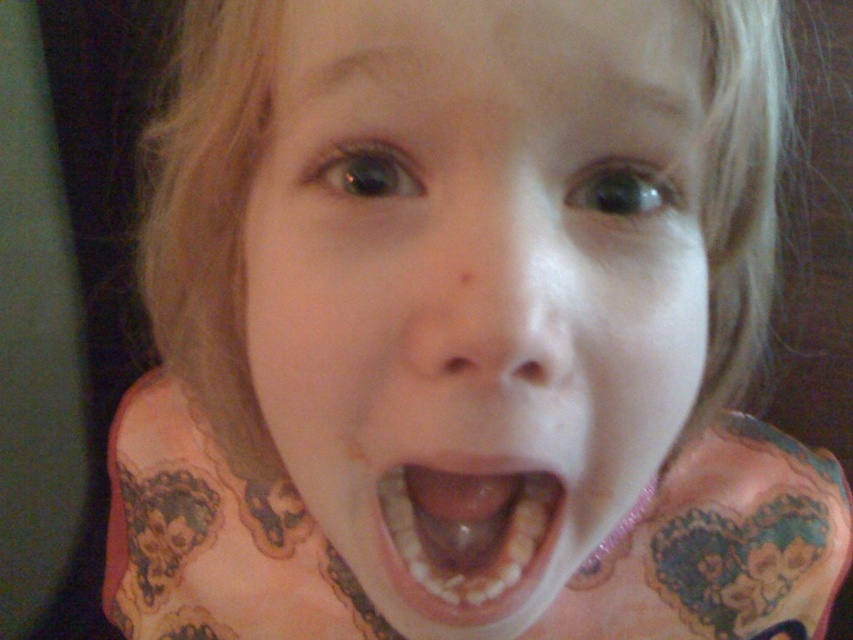
Which is below, pale skin at center or yellowish toothpaste at center?

yellowish toothpaste at center is below.

Looking at this image, is the position of pale skin at center less distant than that of yellowish toothpaste at center?

Yes, pale skin at center is in front of yellowish toothpaste at center.

Between point (462, 577) and point (474, 474), which one is positioned behind?

Point (462, 577)

The width and height of the screenshot is (853, 640). What are the coordinates of `pale skin at center` in the screenshot? It's located at [477, 285].